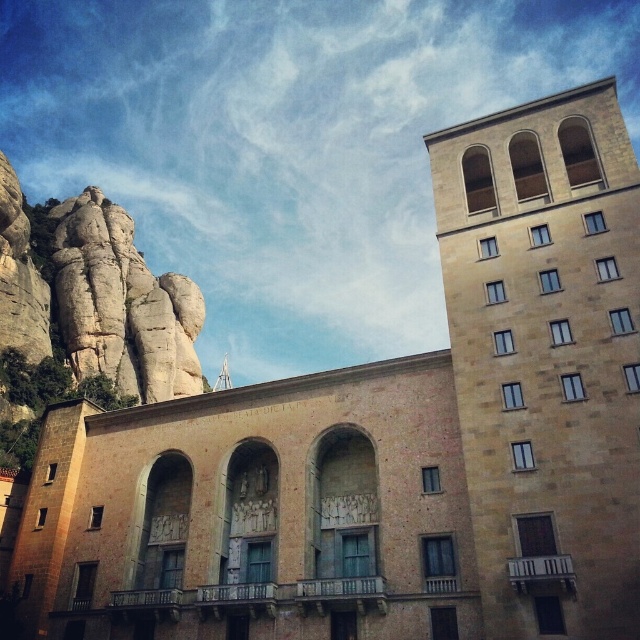
Question: From the image, what is the correct spatial relationship of brown stone tower at upper right in relation to light beige stone rock formation at upper left?

Choices:
 (A) left
 (B) right

Answer: (B)

Question: Does brown stone tower at upper right have a greater width compared to light beige stone rock formation at upper left?

Choices:
 (A) yes
 (B) no

Answer: (B)

Question: Which object is closer to the camera taking this photo?

Choices:
 (A) light beige stone rock formation at upper left
 (B) brown stone tower at upper right

Answer: (B)

Question: Does brown stone tower at upper right have a larger size compared to light beige stone rock formation at upper left?

Choices:
 (A) yes
 (B) no

Answer: (B)